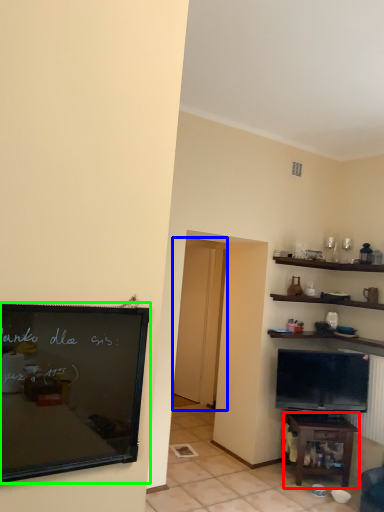
Question: Which object is the farthest from table (highlighted by a red box)? Choose among these: glass door (highlighted by a blue box) or bulletin board (highlighted by a green box).

Choices:
 (A) glass door
 (B) bulletin board

Answer: (B)